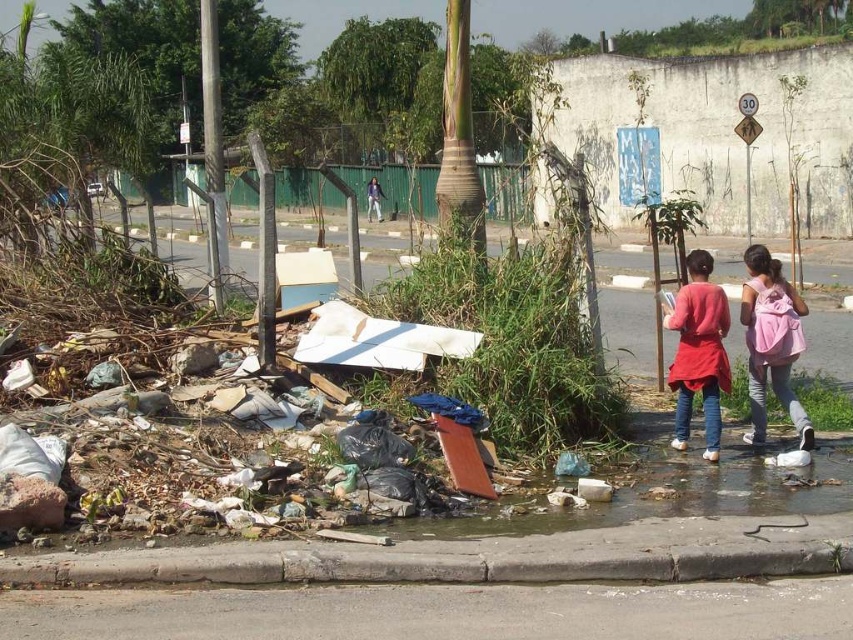
Question: Which of the following is the farthest from the observer?

Choices:
 (A) (370, 180)
 (B) (177, 572)
 (C) (700, 298)

Answer: (A)

Question: Does gray concrete curb at lower center have a smaller size compared to matte red sweater at center?

Choices:
 (A) no
 (B) yes

Answer: (B)

Question: Which point is farther to the camera?

Choices:
 (A) (802, 445)
 (B) (367, 186)
 (C) (740, 576)
 (D) (677, 397)

Answer: (B)

Question: Which point is farther to the camera?

Choices:
 (A) (701, 577)
 (B) (751, 275)

Answer: (B)

Question: Is gray concrete curb at lower center above matte red sweater at center?

Choices:
 (A) yes
 (B) no

Answer: (B)

Question: Does matte red sweater at center appear on the left side of purple fabric at center?

Choices:
 (A) yes
 (B) no

Answer: (B)